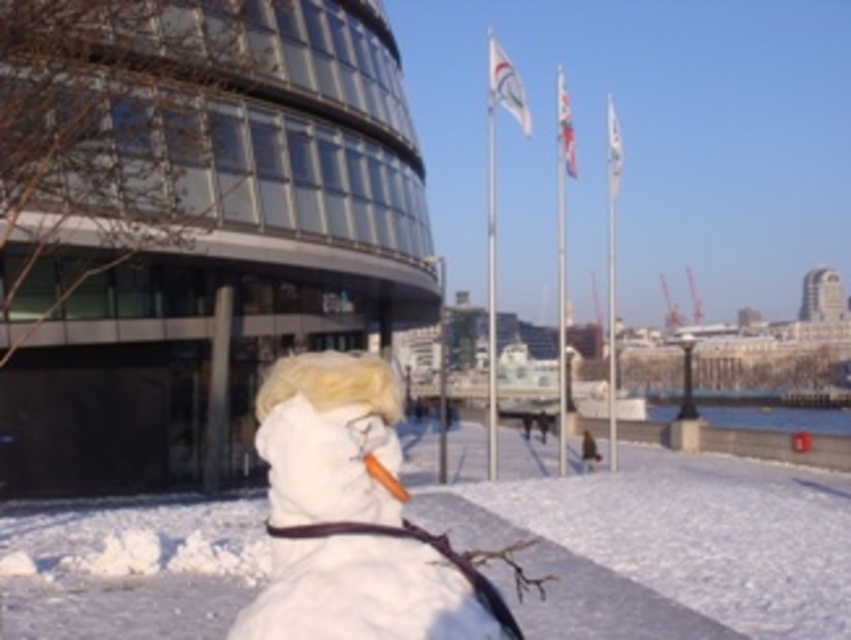
Who is higher up, white fluffy snowman at lower center or blonde synthetic wig at center?

Positioned higher is blonde synthetic wig at center.

Who is more forward, (712,548) or (292,362)?

Point (292,362) is more forward.

Who is more forward, [678,460] or [284,388]?

Point [284,388] is in front.

Locate an element on the screen. This screenshot has height=640, width=851. white fluffy snowman at lower center is located at coordinates (650, 538).

Which is in front, point (293, 381) or point (288, 378)?

Positioned in front is point (293, 381).

Describe the element at coordinates (352, 516) in the screenshot. I see `white fluffy snowman at center` at that location.

Locate an element on the screen. This screenshot has height=640, width=851. white fluffy snowman at center is located at coordinates (352, 516).

The height and width of the screenshot is (640, 851). In order to click on white fluffy snowman at center in this screenshot , I will do `click(352, 516)`.

Does point (801, 508) lie in front of point (292, 579)?

No, (801, 508) is further to viewer.

Is white fluffy snowman at lower center to the right of white fluffy snowman at center from the viewer's perspective?

Indeed, white fluffy snowman at lower center is positioned on the right side of white fluffy snowman at center.

Is point (534, 465) positioned after point (326, 614)?

That is True.

Locate an element on the screen. white fluffy snowman at lower center is located at coordinates (650, 538).